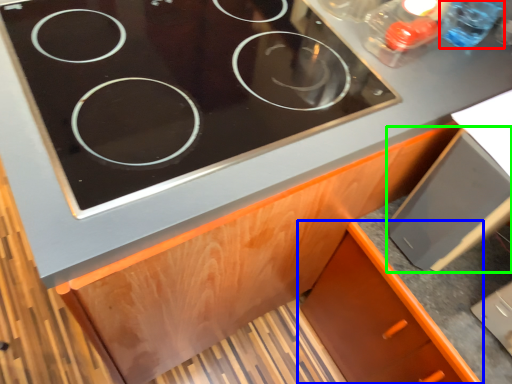
Question: Estimate the real-world distances between objects in this image. Which object is closer to bottle (highlighted by a red box), cabinetry (highlighted by a blue box) or appliance (highlighted by a green box)?

Choices:
 (A) cabinetry
 (B) appliance

Answer: (B)